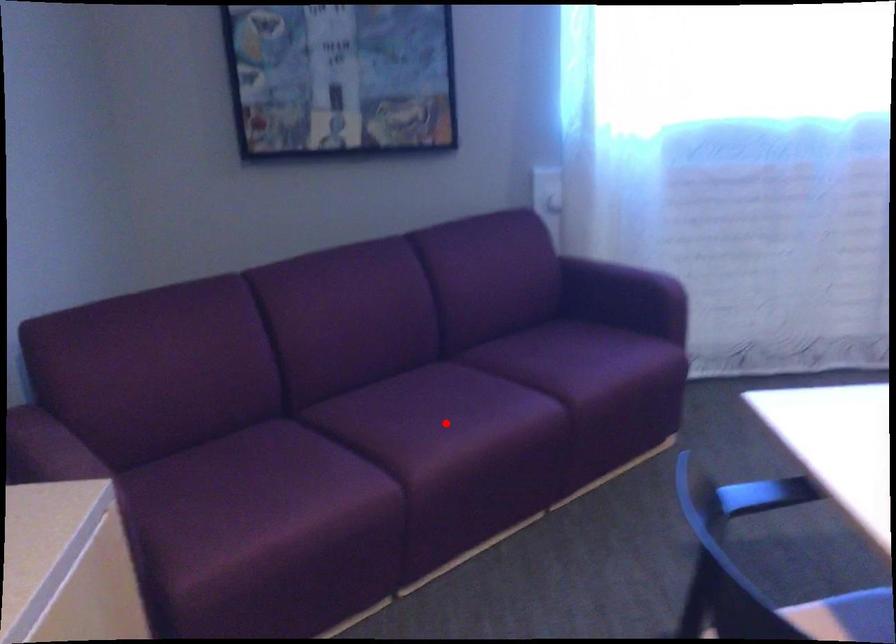
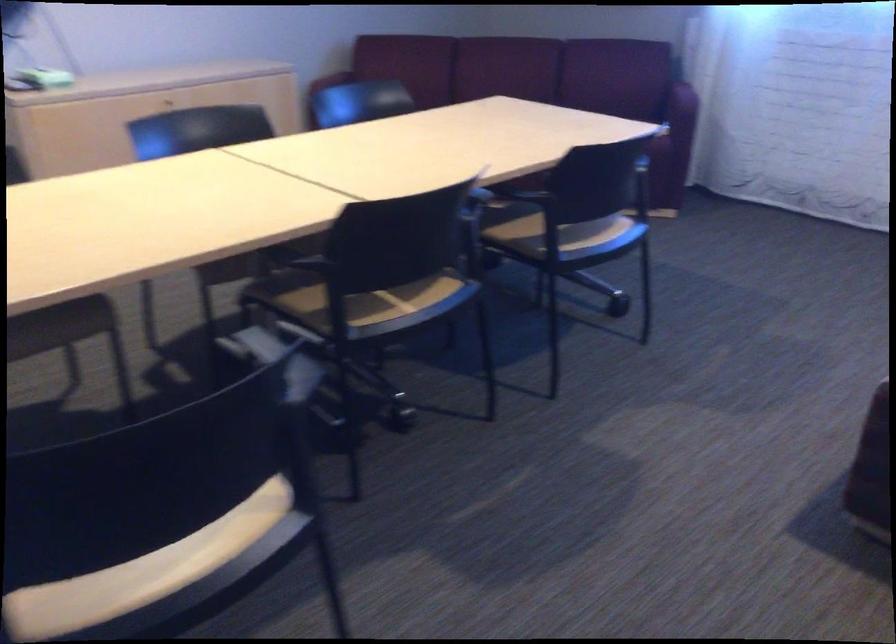
Question: I am providing you with two images of the same scene from different viewpoints. A red point is marked on the first image. At the location where the point appears in image 1, is it still visible in image 2?

Choices:
 (A) Yes
 (B) No

Answer: (B)